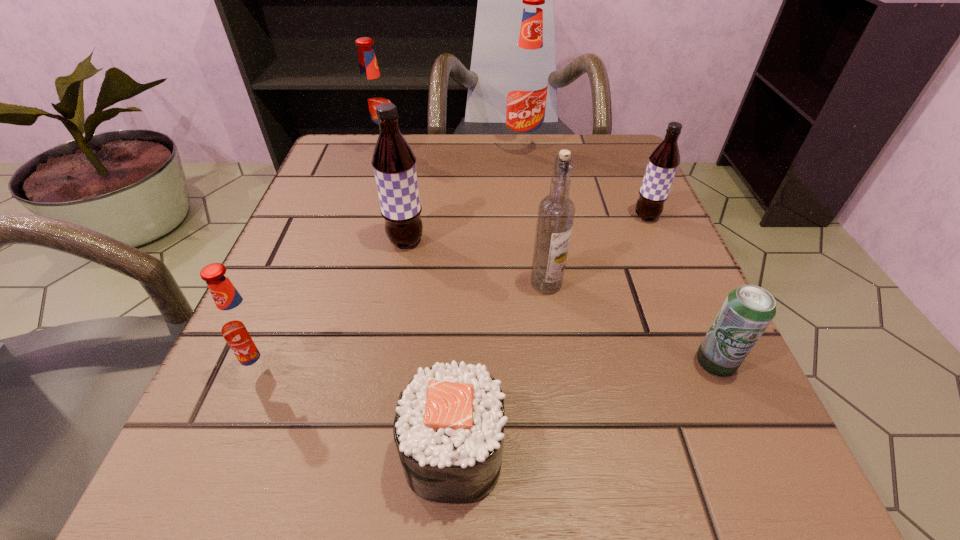
Identify the location of the leftmost object. The image size is (960, 540). (245, 328).

Where is `beer can`? beer can is located at coordinates (747, 311).

Locate an element on the screen. The height and width of the screenshot is (540, 960). the fifth object from right to left is located at coordinates (449, 423).

Where is `sushi`? The height and width of the screenshot is (540, 960). sushi is located at coordinates (449, 423).

This screenshot has height=540, width=960. In order to click on free space located on the right of the tallest object in this screenshot , I will do `click(590, 148)`.

I want to click on free space located on the right of the second object from left to right, so pyautogui.click(x=577, y=157).

Locate an element on the screen. free space located 0.100m on the right of the fifth nearest object is located at coordinates (483, 241).

Identify the location of vacant space located 0.180m on the label of the fourth nearest object. (564, 402).

Where is `vacant area located on the front of the third nearest root beer`? The width and height of the screenshot is (960, 540). vacant area located on the front of the third nearest root beer is located at coordinates point(660,247).

At what (x,y) coordinates should I click in order to perform the action: click on vacant space located 0.130m on the front of the leftmost root beer. Please return your answer as a coordinate pair (x, y). The height and width of the screenshot is (540, 960). Looking at the image, I should click on (219, 489).